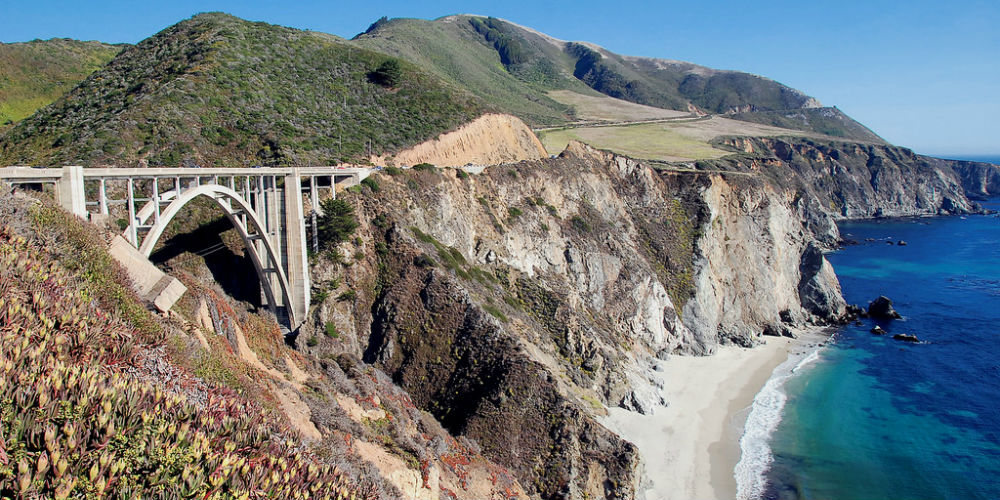
Where is `arch`? This screenshot has width=1000, height=500. arch is located at coordinates (206, 206).